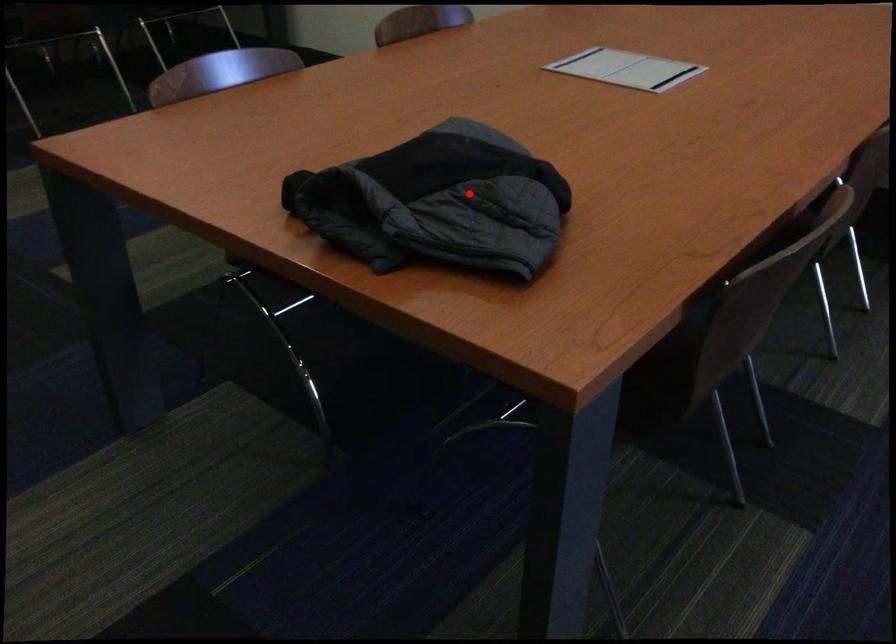
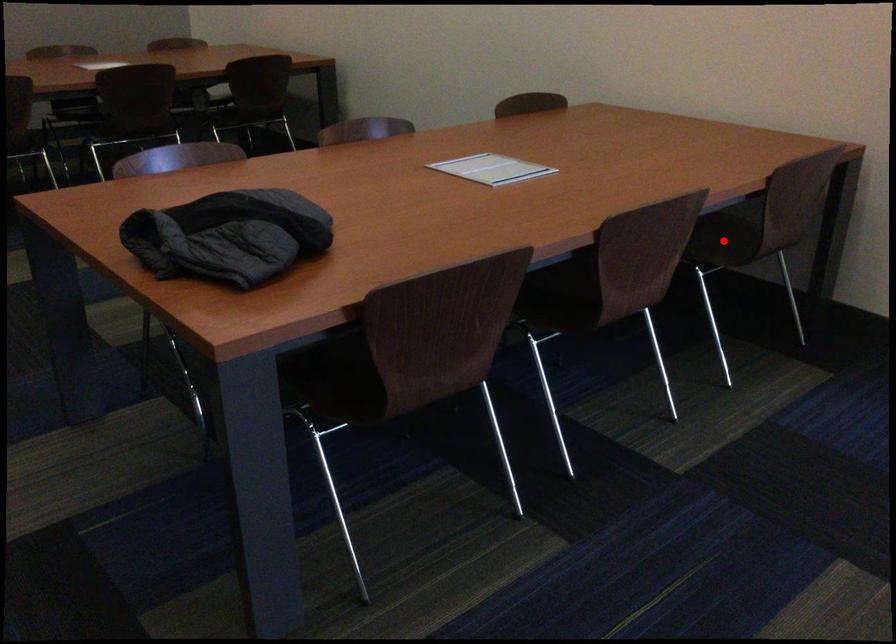
From the picture: I am providing you with two images of the same scene from different viewpoints. A red point is marked on the first image and another point is marked on the second image. Is the red point in image1 aligned with the point shown in image2?

No